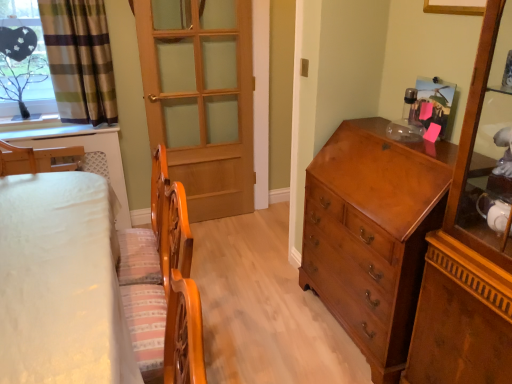
Question: Is clear glass tree at upper left looking in the opposite direction of wooden door at center?

Choices:
 (A) no
 (B) yes

Answer: (A)

Question: From a real-world perspective, is clear glass tree at upper left under wooden door at center?

Choices:
 (A) yes
 (B) no

Answer: (B)

Question: From the image's perspective, is clear glass tree at upper left under wooden door at center?

Choices:
 (A) yes
 (B) no

Answer: (B)

Question: Is the position of clear glass tree at upper left less distant than that of wooden door at center?

Choices:
 (A) yes
 (B) no

Answer: (A)

Question: Is clear glass tree at upper left oriented towards wooden door at center?

Choices:
 (A) yes
 (B) no

Answer: (B)

Question: Considering the relative sizes of clear glass tree at upper left and wooden door at center in the image provided, is clear glass tree at upper left wider than wooden door at center?

Choices:
 (A) yes
 (B) no

Answer: (A)

Question: Is green plaid fabric at upper left taller than shiny brown wooden chest of drawers at right?

Choices:
 (A) yes
 (B) no

Answer: (B)

Question: From the image's perspective, would you say green plaid fabric at upper left is shown under shiny brown wooden chest of drawers at right?

Choices:
 (A) yes
 (B) no

Answer: (B)

Question: Is the depth of green plaid fabric at upper left greater than that of shiny brown wooden chest of drawers at right?

Choices:
 (A) no
 (B) yes

Answer: (B)

Question: Is green plaid fabric at upper left thinner than shiny brown wooden chest of drawers at right?

Choices:
 (A) no
 (B) yes

Answer: (B)

Question: Considering the relative sizes of green plaid fabric at upper left and shiny brown wooden chest of drawers at right in the image provided, is green plaid fabric at upper left bigger than shiny brown wooden chest of drawers at right?

Choices:
 (A) yes
 (B) no

Answer: (B)

Question: Is green plaid fabric at upper left facing away from shiny brown wooden chest of drawers at right?

Choices:
 (A) yes
 (B) no

Answer: (B)

Question: Can you confirm if white fabric bed at left is positioned to the left of clear glass tree at upper left?

Choices:
 (A) no
 (B) yes

Answer: (A)